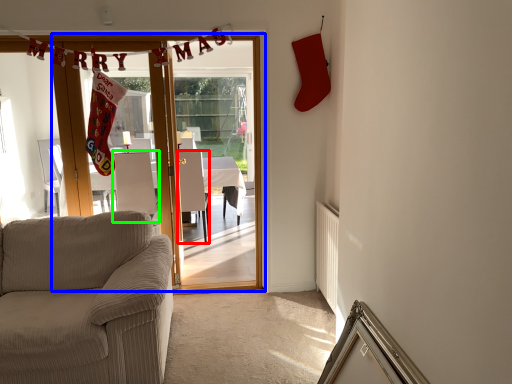
Question: Considering the real-world distances, which object is farthest from armchair (highlighted by a red box)? door (highlighted by a blue box) or armchair (highlighted by a green box)?

Choices:
 (A) door
 (B) armchair

Answer: (A)